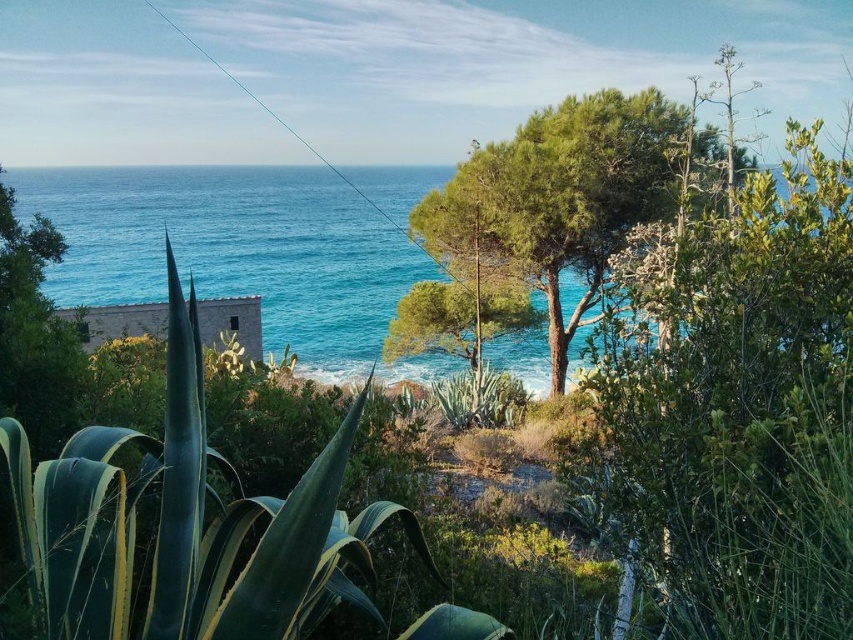
Can you confirm if blue water at left is bigger than green leafy tree at center?

Correct, blue water at left is larger in size than green leafy tree at center.

Locate an element on the screen. The width and height of the screenshot is (853, 640). blue water at left is located at coordinates (233, 248).

I want to click on blue water at left, so click(x=233, y=248).

Locate an element on the screen. The height and width of the screenshot is (640, 853). blue water at left is located at coordinates (233, 248).

Does blue water at left appear on the left side of green leafy tree at left?

Indeed, blue water at left is positioned on the left side of green leafy tree at left.

Image resolution: width=853 pixels, height=640 pixels. What do you see at coordinates (233, 248) in the screenshot?
I see `blue water at left` at bounding box center [233, 248].

Locate an element on the screen. The image size is (853, 640). blue water at left is located at coordinates (233, 248).

Based on the photo, is green leafy tree at center positioned before green leafy tree at left?

No, green leafy tree at center is further to the viewer.

Does green leafy tree at center have a lesser height compared to green leafy tree at left?

Incorrect, green leafy tree at center's height does not fall short of green leafy tree at left's.

Does point (450, 218) come in front of point (28, 380)?

No, it is behind (28, 380).

At what (x,y) coordinates should I click in order to perform the action: click on green leafy tree at center. Please return your answer as a coordinate pair (x, y). Image resolution: width=853 pixels, height=640 pixels. Looking at the image, I should click on (556, 202).